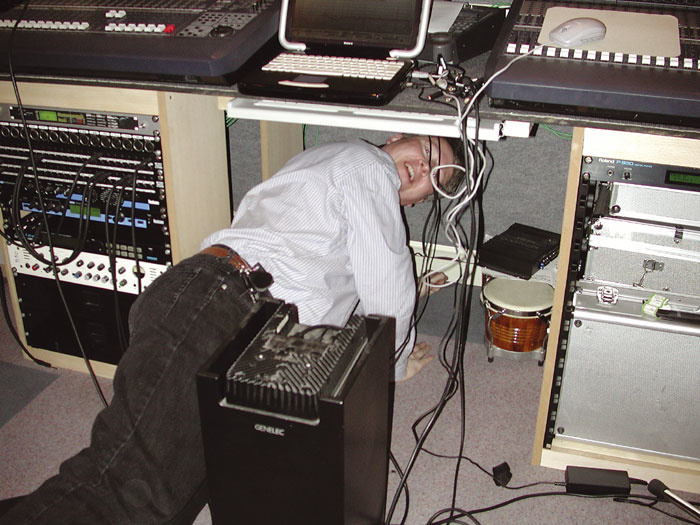
This screenshot has width=700, height=525. I want to click on wires, so click(x=22, y=116), click(x=474, y=171), click(x=465, y=177), click(x=458, y=196), click(x=432, y=225), click(x=423, y=233), click(x=64, y=307), click(x=113, y=304).